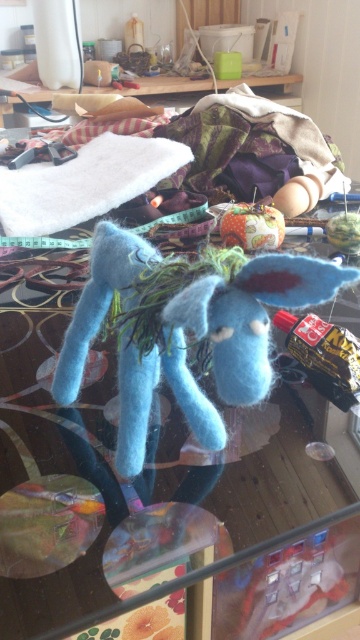
You are organizing the workspace and need to place the fuzzy blue stuffed animal at center and the white fluffy cloth at upper left into a storage box. Which object should you pick up first if you want to start with the one closer to the left side of the workspace?

The white fluffy cloth at upper left should be picked up first because it is located to the left of the fuzzy blue stuffed animal at center.

You are a delivery person who needs to place a new 1.8 meter long package on the wooden table at upper center. The fuzzy blue stuffed animal at center is in the way. Is there enough space to place the package without moving the stuffed animal?

The fuzzy blue stuffed animal at center is 1.77 meters away from the wooden table at upper center. Since the package is 1.8 meters long, it would extend beyond the current position of the stuffed animal by 0.03 meters. Therefore, the package cannot be placed without moving the stuffed animal to ensure it fits entirely on the table.

You are a delivery robot with a height of 80 centimeters. You need to place a small package on the table without knocking over the light blue, felted stuffed animal resembling a donkey. The package will be placed at point (x=45, y=173) on the table. Will the robot be able to reach that point without exceeding its height limit?

The distance of point (x=45, y=173) from camera is 84.40 centimeters. Since the robot is 80 centimeters tall, it cannot reach the point (x=45, y=173) as it is 4.4 centimeters taller than the robot.